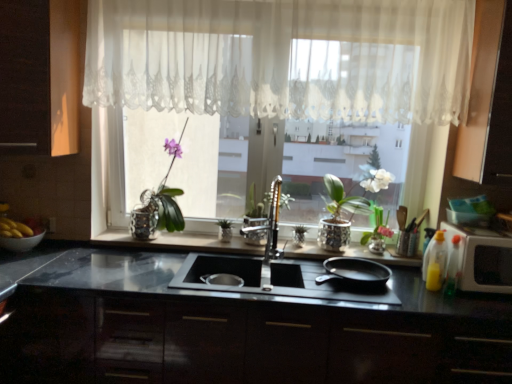
What do you see at coordinates (355, 272) in the screenshot? The image size is (512, 384). I see `black matte frying pan at right` at bounding box center [355, 272].

What do you see at coordinates (467, 218) in the screenshot?
I see `transparent glass bowl at right, arranged as the first glass bowl when viewed from the top` at bounding box center [467, 218].

This screenshot has height=384, width=512. What do you see at coordinates (284, 58) in the screenshot?
I see `white lace curtain at upper center` at bounding box center [284, 58].

Image resolution: width=512 pixels, height=384 pixels. What are the coordinates of `matte white bowl at left, which is the first glass bowl in left-to-right order` in the screenshot? It's located at (21, 242).

In order to face matte white bowl at left, which is the first glass bowl in bottom-to-top order, should I rotate leftwards or rightwards?

You should look left and rotate roughly 29.156 degrees.

Locate an element on the screen. The image size is (512, 384). white glossy microwave at right is located at coordinates (481, 258).

Locate an element on the screen. The image size is (512, 384). white glossy pot at center is located at coordinates (338, 215).

The width and height of the screenshot is (512, 384). I want to click on dark wood cabinet at left, arranged as the first cabinetry when viewed from the left, so click(40, 76).

Find the location of a particular element. Image resolution: width=512 pixels, height=384 pixels. black matte frying pan at right is located at coordinates (355, 272).

From a real-world perspective, which is physically above, transparent glass bowl at right, the 1th glass bowl viewed from the right, or white glossy pot at center?

transparent glass bowl at right, the 1th glass bowl viewed from the right, from a real-world perspective.

Is transparent glass bowl at right, arranged as the first glass bowl when viewed from the top, positioned before white glossy pot at center?

Yes, transparent glass bowl at right, arranged as the first glass bowl when viewed from the top, is in front of white glossy pot at center.

Does transparent glass bowl at right, the 1th glass bowl viewed from the right, have a lesser height compared to white glossy pot at center?

Yes, transparent glass bowl at right, the 1th glass bowl viewed from the right, is shorter than white glossy pot at center.

Is matte wood cabinet at upper right, which appears as the 2th cabinetry when viewed from the top, wider than pink glass vase at center?

Yes.

From the image's perspective, which is above, matte wood cabinet at upper right, the 1th cabinetry viewed from the right, or pink glass vase at center?

matte wood cabinet at upper right, the 1th cabinetry viewed from the right, is shown above in the image.

Image resolution: width=512 pixels, height=384 pixels. I want to click on cabinetry located on the right of pink glass vase at center, so click(x=488, y=98).

Based on the photo, what's the angular difference between matte wood cabinet at upper right, which appears as the 2th cabinetry when viewed from the top, and pink glass vase at center's facing directions?

2.72 degrees.

Could you tell me if yellow translucent bottle at right, the 1th bottle positioned from the right, is turned towards black glossy cabinetry at center, acting as the second cabinetry starting from the left?

No, yellow translucent bottle at right, the 1th bottle positioned from the right, is not facing towards black glossy cabinetry at center, acting as the second cabinetry starting from the left.

Does point (451, 293) appear closer or farther from the camera than point (313, 344)?

Point (451, 293) is farther from the camera than point (313, 344).

Are yellow translucent bottle at right, the 1th bottle positioned from the right, and black glossy cabinetry at center, which is the 1th cabinetry from bottom to top, beside each other?

No.

Does yellow translucent bottle at right, the 1th bottle positioned from the right, appear on the right side of black glossy cabinetry at center, which is the 1th cabinetry from bottom to top?

Yes.

How many degrees apart are the facing directions of translucent plastic bottle at right, the second bottle in the right-to-left sequence, and black glossy cabinetry at center, which is the 3th cabinetry from top to bottom?

translucent plastic bottle at right, the second bottle in the right-to-left sequence, and black glossy cabinetry at center, which is the 3th cabinetry from top to bottom, are facing 17.2 degrees away from each other.

Looking at their sizes, would you say translucent plastic bottle at right, which ranks as the 1th bottle in left-to-right order, is wider or thinner than black glossy cabinetry at center, marked as the second cabinetry in a right-to-left arrangement?

In the image, translucent plastic bottle at right, which ranks as the 1th bottle in left-to-right order, appears to be more narrow than black glossy cabinetry at center, marked as the second cabinetry in a right-to-left arrangement.

From a real-world perspective, who is located higher, translucent plastic bottle at right, which ranks as the 1th bottle in left-to-right order, or black glossy cabinetry at center, acting as the second cabinetry starting from the left?

From a 3D spatial view, translucent plastic bottle at right, which ranks as the 1th bottle in left-to-right order, is above.

In the scene shown: Can you confirm if translucent plastic bottle at right, which ranks as the 1th bottle in left-to-right order, is shorter than black glossy cabinetry at center, marked as the second cabinetry in a right-to-left arrangement?

Yes.

Would you say white lace curtain at upper center is inside or outside matte wood cabinet at upper right, placed as the third cabinetry when sorted from left to right?

The correct answer is: outside.

Does point (269, 96) come in front of point (482, 64)?

No, it is not.

From the image's perspective, would you say white glossy microwave at right is positioned over matte white bowl at left, placed as the 2th glass bowl when sorted from top to bottom?

No, from the image's perspective, white glossy microwave at right is not over matte white bowl at left, placed as the 2th glass bowl when sorted from top to bottom.

Is white glossy microwave at right to the left of matte white bowl at left, placed as the 2th glass bowl when sorted from top to bottom, from the viewer's perspective?

In fact, white glossy microwave at right is to the right of matte white bowl at left, placed as the 2th glass bowl when sorted from top to bottom.

Does point (499, 242) come closer to viewer compared to point (15, 246)?

Yes, it is in front of point (15, 246).

Is transparent glass bowl at right, the 1th glass bowl viewed from the right, not within dark wood cabinet at left, placed as the 1th cabinetry when sorted from top to bottom?

transparent glass bowl at right, the 1th glass bowl viewed from the right, lies outside dark wood cabinet at left, placed as the 1th cabinetry when sorted from top to bottom,'s area.

Can you confirm if transparent glass bowl at right, which ranks as the second glass bowl in left-to-right order, is wider than dark wood cabinet at left, arranged as the first cabinetry when viewed from the left?

No.

Which object is more forward, transparent glass bowl at right, the 1th glass bowl viewed from the right, or dark wood cabinet at left, the third cabinetry from the bottom?

dark wood cabinet at left, the third cabinetry from the bottom, is more forward.

Identify the location of houseplant behind the transparent glass bowl at right, the 1th glass bowl viewed from the right. The image size is (512, 384). (338, 215).

Find the location of a particular element. the 1st cabinetry in front when counting from the pink glass vase at center is located at coordinates (488, 98).

Based on their spatial positions, is yellow matte bananas at left or black matte frying pan at right closer to white lace curtain at upper center?

Among the two, black matte frying pan at right is located nearer to white lace curtain at upper center.

When comparing their distances from yellow translucent bottle at right, the 1th bottle positioned from the right, does pink glass vase at center or transparent glass bowl at right, marked as the second glass bowl in a bottom-to-top arrangement, seem further?

pink glass vase at center lies further to yellow translucent bottle at right, the 1th bottle positioned from the right, than the other object.

Based on their spatial positions, is polished chrome faucet at center or pink glass vase at center further from black glossy cabinetry at center, which is the 3th cabinetry from top to bottom?

pink glass vase at center is further to black glossy cabinetry at center, which is the 3th cabinetry from top to bottom.

Based on their spatial positions, is matte wood cabinet at upper right, which appears as the 2th cabinetry when viewed from the top, or matte white bowl at left, the second glass bowl viewed from the right, further from dark wood cabinet at left, acting as the third cabinetry starting from the right?

The object further to dark wood cabinet at left, acting as the third cabinetry starting from the right, is matte wood cabinet at upper right, which appears as the 2th cabinetry when viewed from the top.

From the image, which object appears to be nearer to transparent glass bowl at right, which ranks as the second glass bowl in left-to-right order, black matte frying pan at right or translucent plastic bottle at right, the second bottle in the right-to-left sequence?

The object closer to transparent glass bowl at right, which ranks as the second glass bowl in left-to-right order, is translucent plastic bottle at right, the second bottle in the right-to-left sequence.

Which object lies further to the anchor point white glossy microwave at right, white lace curtain at upper center or translucent plastic bottle at right, which ranks as the 1th bottle in left-to-right order?

white lace curtain at upper center is further to white glossy microwave at right.

Considering their positions, is white glossy pot at center positioned further to white glossy microwave at right than pink glass vase at center?

Based on the image, white glossy pot at center appears to be further to white glossy microwave at right.

Looking at the image, which one is located further to pink glass vase at center, white lace curtain at upper center or black glossy cabinetry at center, which is the 1th cabinetry from bottom to top?

white lace curtain at upper center is further to pink glass vase at center.

Where is `tap located between yellow matte bananas at left and black glossy cabinetry at center, acting as the second cabinetry starting from the left, in the left-right direction`? This screenshot has height=384, width=512. tap located between yellow matte bananas at left and black glossy cabinetry at center, acting as the second cabinetry starting from the left, in the left-right direction is located at coordinates (270, 223).

Where is `frying pan situated between matte white bowl at left, which is the first glass bowl in left-to-right order, and white glossy pot at center from left to right`? frying pan situated between matte white bowl at left, which is the first glass bowl in left-to-right order, and white glossy pot at center from left to right is located at coordinates (355, 272).

The height and width of the screenshot is (384, 512). I want to click on tap situated between matte white bowl at left, the second glass bowl viewed from the right, and yellow translucent bottle at right, the 1th bottle positioned from the right, from left to right, so click(x=270, y=223).

This screenshot has width=512, height=384. What are the coordinates of `cabinetry located between dark wood cabinet at left, placed as the 1th cabinetry when sorted from top to bottom, and matte wood cabinet at upper right, placed as the third cabinetry when sorted from left to right, in the left-right direction` in the screenshot? It's located at (241, 342).